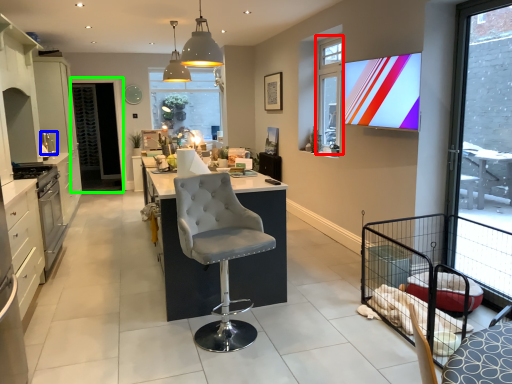
Question: Considering the real-world distances, which object is farthest from window (highlighted by a red box)? appliance (highlighted by a blue box) or screen door (highlighted by a green box)?

Choices:
 (A) appliance
 (B) screen door

Answer: (B)